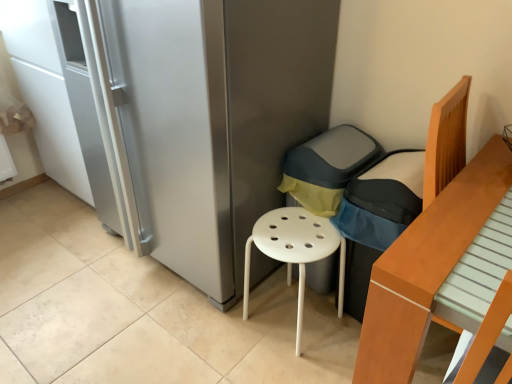
I want to click on free point above white plastic stool at center (from a real-world perspective), so click(297, 232).